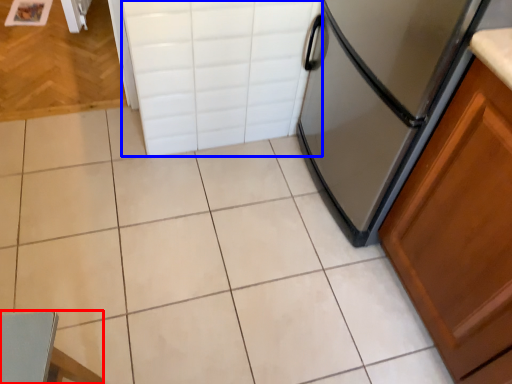
Question: Which of the following is the farthest to the observer, chair (highlighted by a red box) or drawer (highlighted by a blue box)?

Choices:
 (A) chair
 (B) drawer

Answer: (B)